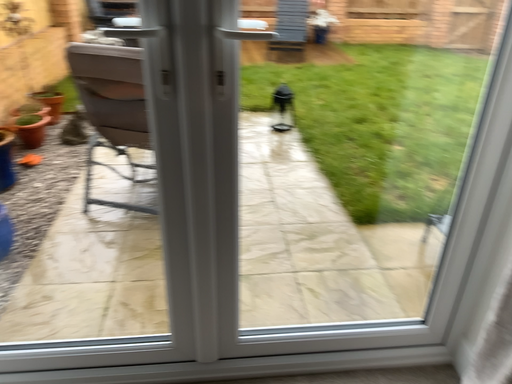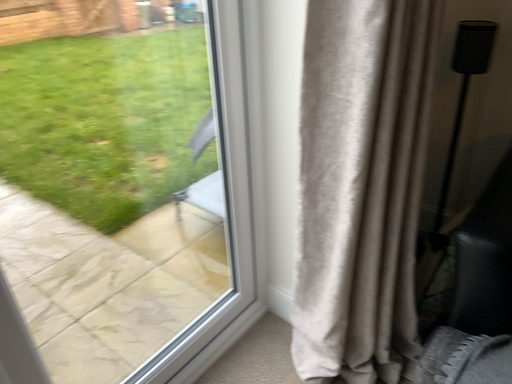
Question: Which way did the camera rotate in the video?

Choices:
 (A) rotated left
 (B) rotated right

Answer: (B)